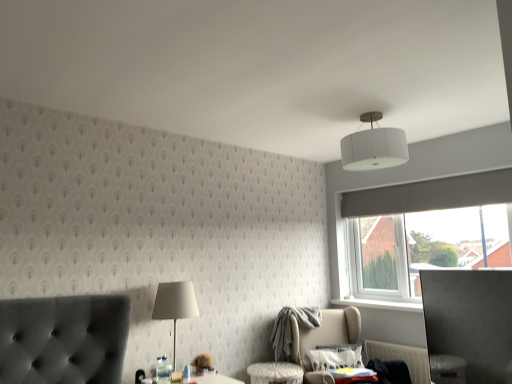
Question: Does white fabric lampshade at center turn towards white plastic radiator at lower right?

Choices:
 (A) no
 (B) yes

Answer: (A)

Question: Is white fabric lampshade at center surrounding white plastic radiator at lower right?

Choices:
 (A) no
 (B) yes

Answer: (A)

Question: From the image's perspective, is white fabric lampshade at center under white plastic radiator at lower right?

Choices:
 (A) yes
 (B) no

Answer: (B)

Question: Is white fabric lampshade at center wider than white plastic radiator at lower right?

Choices:
 (A) yes
 (B) no

Answer: (A)

Question: From a real-world perspective, is white fabric lampshade at center on white plastic radiator at lower right?

Choices:
 (A) no
 (B) yes

Answer: (B)

Question: Are white fabric lampshade at center and white plastic radiator at lower right located far from each other?

Choices:
 (A) no
 (B) yes

Answer: (B)

Question: Would you say white ribbed shade at upper center contains white fabric lampshade at center?

Choices:
 (A) yes
 (B) no

Answer: (B)

Question: Is white ribbed shade at upper center thinner than white fabric lampshade at center?

Choices:
 (A) yes
 (B) no

Answer: (B)

Question: Is white ribbed shade at upper center far away from white fabric lampshade at center?

Choices:
 (A) yes
 (B) no

Answer: (A)

Question: Are white ribbed shade at upper center and white fabric lampshade at center making contact?

Choices:
 (A) yes
 (B) no

Answer: (B)

Question: From a real-world perspective, is white ribbed shade at upper center physically below white fabric lampshade at center?

Choices:
 (A) yes
 (B) no

Answer: (B)

Question: Can you confirm if white ribbed shade at upper center is smaller than white fabric lampshade at center?

Choices:
 (A) no
 (B) yes

Answer: (A)

Question: Is white plastic radiator at lower right smaller than beige fabric swivel chair at lower right?

Choices:
 (A) yes
 (B) no

Answer: (A)